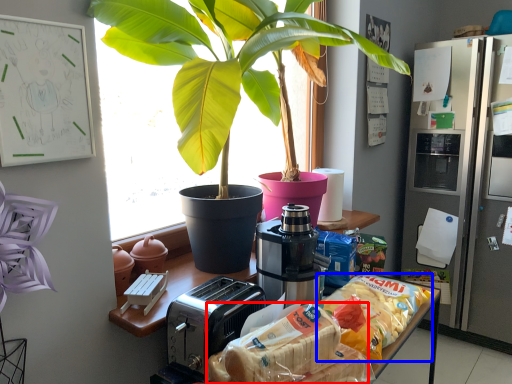
Question: Which of the following is the farthest to the observer, snack (highlighted by a red box) or snack (highlighted by a blue box)?

Choices:
 (A) snack
 (B) snack

Answer: (B)